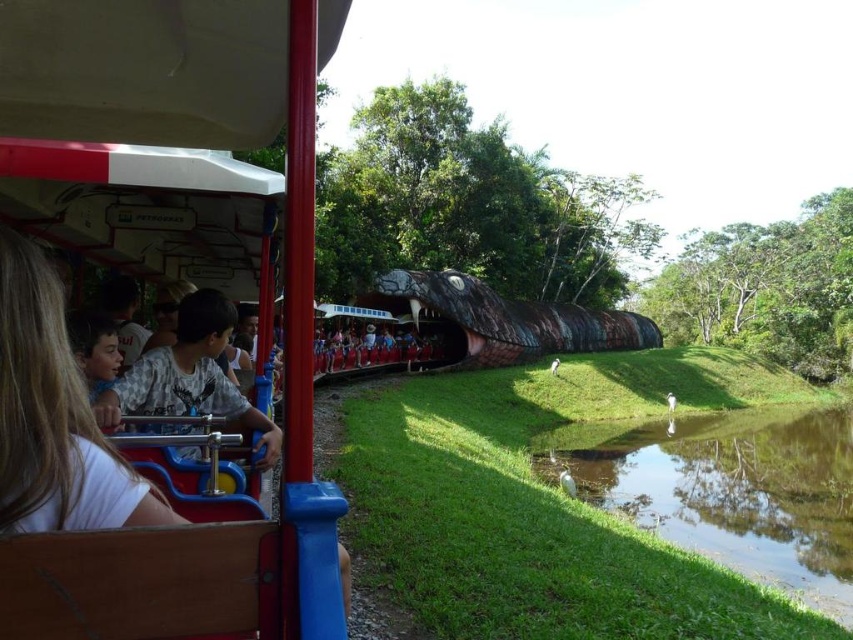
Question: Is green grassy river at lower right further to camera compared to white matte shirt at left?

Choices:
 (A) yes
 (B) no

Answer: (A)

Question: Is white matte shirt at left behind matte red shirt at center?

Choices:
 (A) no
 (B) yes

Answer: (A)

Question: Which object appears farthest from the camera in this image?

Choices:
 (A) white matte shirt at left
 (B) matte red shirt at center
 (C) green grassy river at lower right

Answer: (B)

Question: Which object is closer to the camera taking this photo?

Choices:
 (A) white matte shirt at left
 (B) matte red shirt at center

Answer: (A)

Question: Does green grassy river at lower right appear on the right side of white matte shirt at left?

Choices:
 (A) no
 (B) yes

Answer: (B)

Question: Among these objects, which one is nearest to the camera?

Choices:
 (A) white matte shirt at left
 (B) matte red shirt at center

Answer: (A)